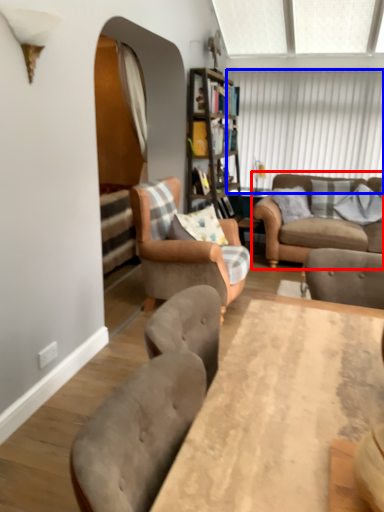
Question: Which of the following is the closest to the observer, studio couch (highlighted by a red box) or window screen (highlighted by a blue box)?

Choices:
 (A) studio couch
 (B) window screen

Answer: (A)